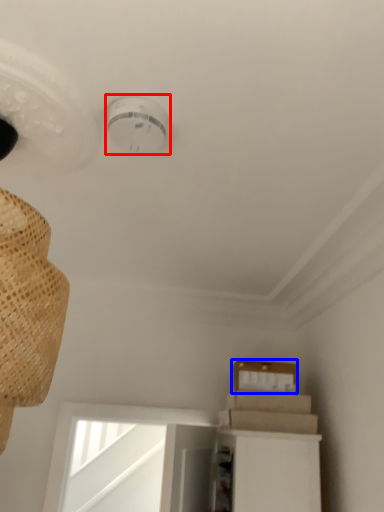
Question: Which object is further to the camera taking this photo, lamp (highlighted by a red box) or cardboard box (highlighted by a blue box)?

Choices:
 (A) lamp
 (B) cardboard box

Answer: (B)